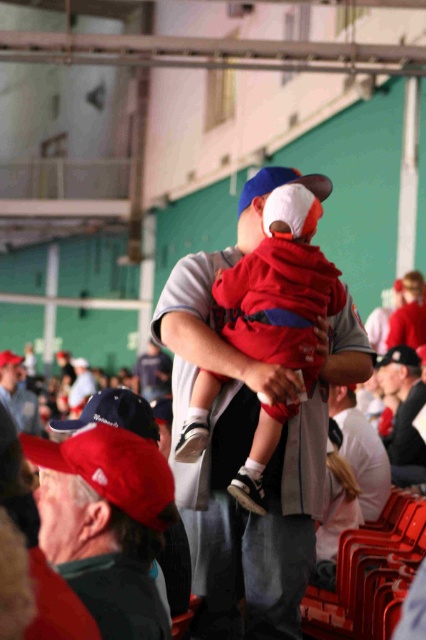
Identify the location of red cotton shirt at center. This screenshot has height=640, width=426. (250, 566).

Image resolution: width=426 pixels, height=640 pixels. In order to click on red cotton shirt at center in this screenshot , I will do `click(250, 566)`.

The height and width of the screenshot is (640, 426). What are the coordinates of `red cotton shirt at center` in the screenshot? It's located at (250, 566).

Does red cotton shirt at center have a lesser width compared to red fleece baby at center?

In fact, red cotton shirt at center might be wider than red fleece baby at center.

Describe the element at coordinates (250, 566) in the screenshot. This screenshot has width=426, height=640. I see `red cotton shirt at center` at that location.

At what (x,y) coordinates should I click in order to perform the action: click on red cotton shirt at center. Please return your answer as a coordinate pair (x, y). The width and height of the screenshot is (426, 640). Looking at the image, I should click on (250, 566).

Does red cotton shirt at center have a lesser width compared to red fabric cap at lower left?

Incorrect, red cotton shirt at center's width is not less than red fabric cap at lower left's.

Which of these two, red cotton shirt at center or red fabric cap at lower left, stands taller?

red cotton shirt at center

Does point (313, 552) lie in front of point (118, 461)?

No, it is behind (118, 461).

This screenshot has width=426, height=640. I want to click on red cotton shirt at center, so click(x=250, y=566).